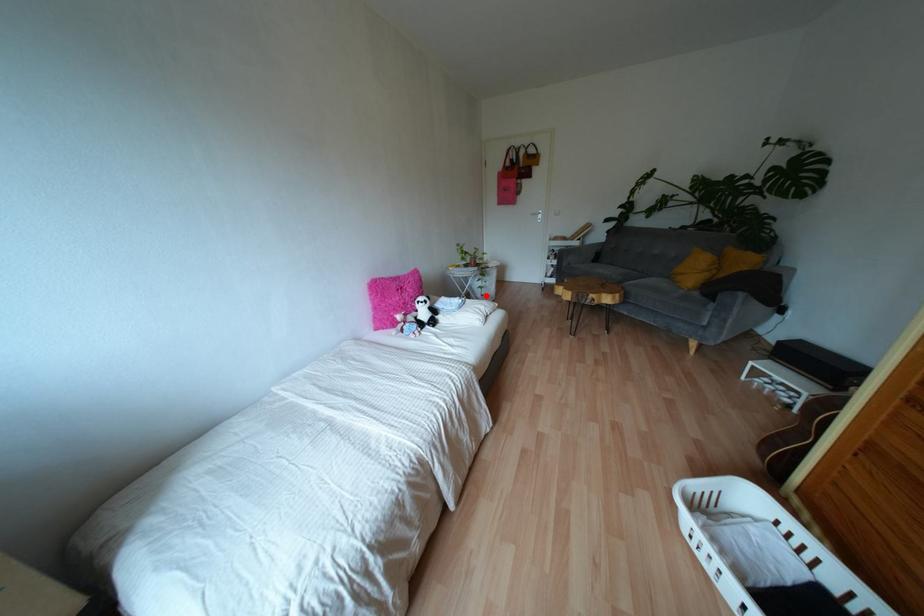
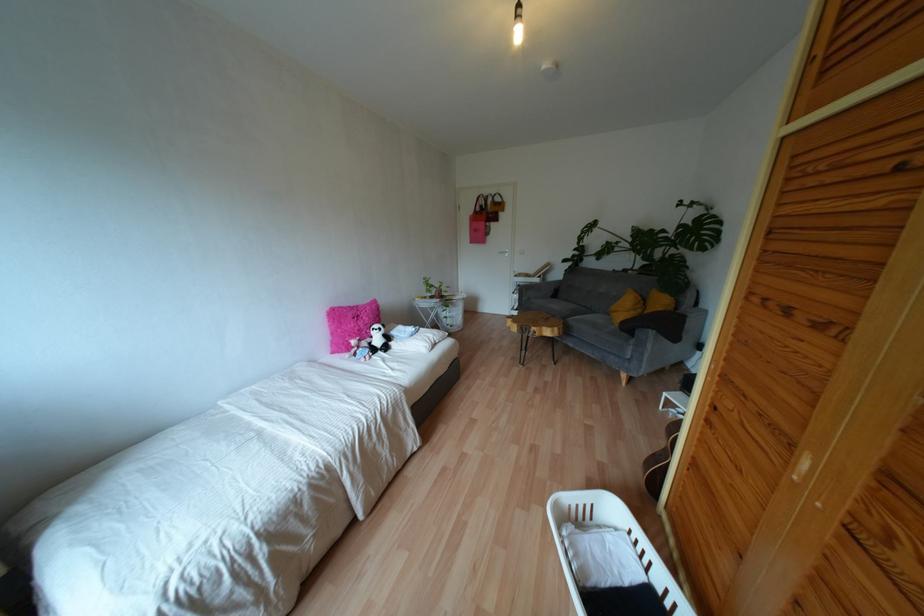
The point at the highlighted location is marked in the first image. Where is the corresponding point in the second image?

(450, 325)